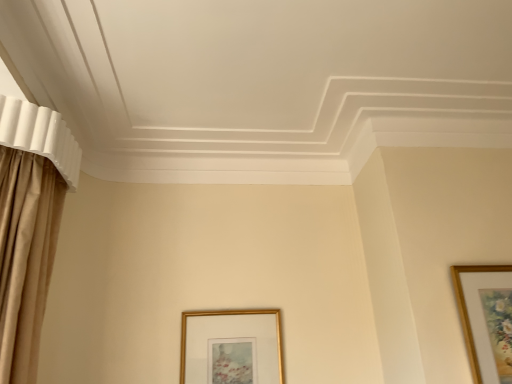
Question: Which direction should I rotate to face gold metallic picture frame at lower center, the second picture frame when ordered from front to back, — up or down?

Choices:
 (A) down
 (B) up

Answer: (A)

Question: Is gold metallic picture frame at lower center, the first picture frame in the back-to-front sequence, aimed at wooden picture frame at upper right, the 2th picture frame viewed from the back?

Choices:
 (A) yes
 (B) no

Answer: (B)

Question: Is wooden picture frame at upper right, which ranks as the first picture frame in right-to-left order, at the back of gold metallic picture frame at lower center, placed as the first picture frame when sorted from left to right?

Choices:
 (A) no
 (B) yes

Answer: (A)

Question: Is gold metallic picture frame at lower center, which ranks as the 2th picture frame in right-to-left order, to the right of wooden picture frame at upper right, marked as the 2th picture frame in a left-to-right arrangement, from the viewer's perspective?

Choices:
 (A) no
 (B) yes

Answer: (A)

Question: Considering the relative sizes of gold metallic picture frame at lower center, the first picture frame in the back-to-front sequence, and wooden picture frame at upper right, the 2th picture frame viewed from the back, in the image provided, is gold metallic picture frame at lower center, the first picture frame in the back-to-front sequence, bigger than wooden picture frame at upper right, the 2th picture frame viewed from the back,?

Choices:
 (A) no
 (B) yes

Answer: (A)

Question: From the image's perspective, would you say gold metallic picture frame at lower center, the first picture frame in the back-to-front sequence, is shown under wooden picture frame at upper right, which ranks as the first picture frame in right-to-left order?

Choices:
 (A) yes
 (B) no

Answer: (A)

Question: Can you confirm if gold metallic picture frame at lower center, placed as the first picture frame when sorted from left to right, is smaller than wooden picture frame at upper right, which ranks as the first picture frame in right-to-left order?

Choices:
 (A) yes
 (B) no

Answer: (A)

Question: Considering the relative sizes of wooden picture frame at upper right, which ranks as the first picture frame in right-to-left order, and gold metallic picture frame at lower center, which ranks as the 2th picture frame in right-to-left order, in the image provided, is wooden picture frame at upper right, which ranks as the first picture frame in right-to-left order, thinner than gold metallic picture frame at lower center, which ranks as the 2th picture frame in right-to-left order,?

Choices:
 (A) yes
 (B) no

Answer: (B)

Question: Is wooden picture frame at upper right, marked as the 2th picture frame in a left-to-right arrangement, taller than gold metallic picture frame at lower center, the first picture frame in the back-to-front sequence?

Choices:
 (A) yes
 (B) no

Answer: (A)

Question: Considering the relative positions of wooden picture frame at upper right, which ranks as the first picture frame in right-to-left order, and gold metallic picture frame at lower center, which ranks as the 2th picture frame in right-to-left order, in the image provided, is wooden picture frame at upper right, which ranks as the first picture frame in right-to-left order, to the right of gold metallic picture frame at lower center, which ranks as the 2th picture frame in right-to-left order, from the viewer's perspective?

Choices:
 (A) no
 (B) yes

Answer: (B)

Question: From a real-world perspective, is wooden picture frame at upper right, which is counted as the 1th picture frame, starting from the front, under gold metallic picture frame at lower center, which ranks as the 2th picture frame in right-to-left order?

Choices:
 (A) no
 (B) yes

Answer: (A)

Question: Is wooden picture frame at upper right, which is counted as the 1th picture frame, starting from the front, at the left side of gold metallic picture frame at lower center, which ranks as the 2th picture frame in right-to-left order?

Choices:
 (A) yes
 (B) no

Answer: (B)

Question: Is gold metallic picture frame at lower center, which ranks as the 2th picture frame in right-to-left order, inside wooden picture frame at upper right, marked as the 2th picture frame in a left-to-right arrangement?

Choices:
 (A) yes
 (B) no

Answer: (B)

Question: Considering their positions, is wooden picture frame at upper right, which ranks as the first picture frame in right-to-left order, located in front of or behind gold metallic picture frame at lower center, placed as the first picture frame when sorted from left to right?

Choices:
 (A) front
 (B) behind

Answer: (A)